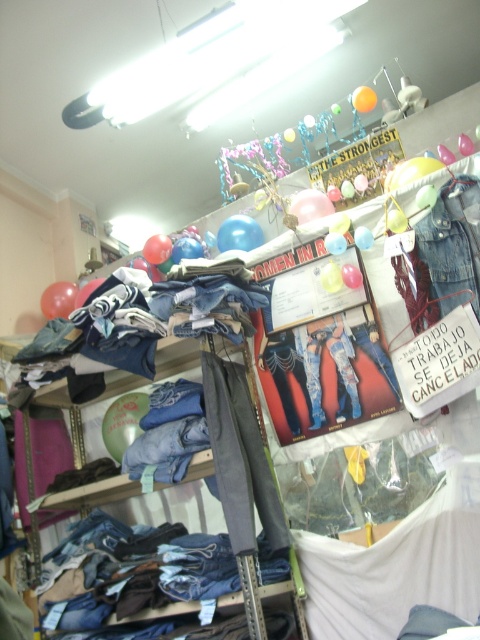
You are a customer in a store and you want to reach the denim jeans at lower left. The store has a rule that you must stay at least 1.5 meters away from all items to allow others to pass. Are you currently within the allowed distance?

The distance between you and the denim jeans at lower left is 1.83 meters, which is more than the required 1.5 meters, so you are within the store policy.